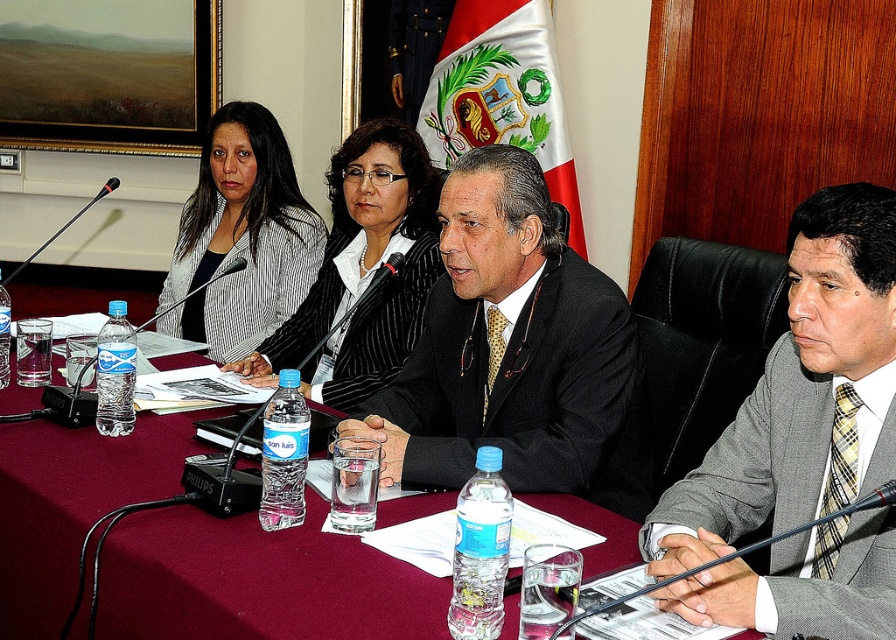
Question: Which object appears farthest from the camera in this image?

Choices:
 (A) black satin suit at center
 (B) maroon fabric table at center
 (C) striped fabric jacket at upper left
 (D) gray textured suit at center

Answer: (C)

Question: Can you confirm if gray textured suit at center is bigger than striped fabric jacket at upper left?

Choices:
 (A) no
 (B) yes

Answer: (A)

Question: Among these objects, which one is nearest to the camera?

Choices:
 (A) matte black blazer at center
 (B) gray textured suit at center
 (C) maroon fabric table at center
 (D) striped fabric jacket at upper left

Answer: (C)

Question: Can you confirm if black satin suit at center is positioned above matte black blazer at center?

Choices:
 (A) yes
 (B) no

Answer: (B)

Question: Which point is closer to the camera taking this photo?

Choices:
 (A) (739, 460)
 (B) (37, 433)
 (C) (612, 372)
 (D) (205, 326)

Answer: (A)

Question: Is gray textured suit at center to the left of black satin suit at center from the viewer's perspective?

Choices:
 (A) no
 (B) yes

Answer: (A)